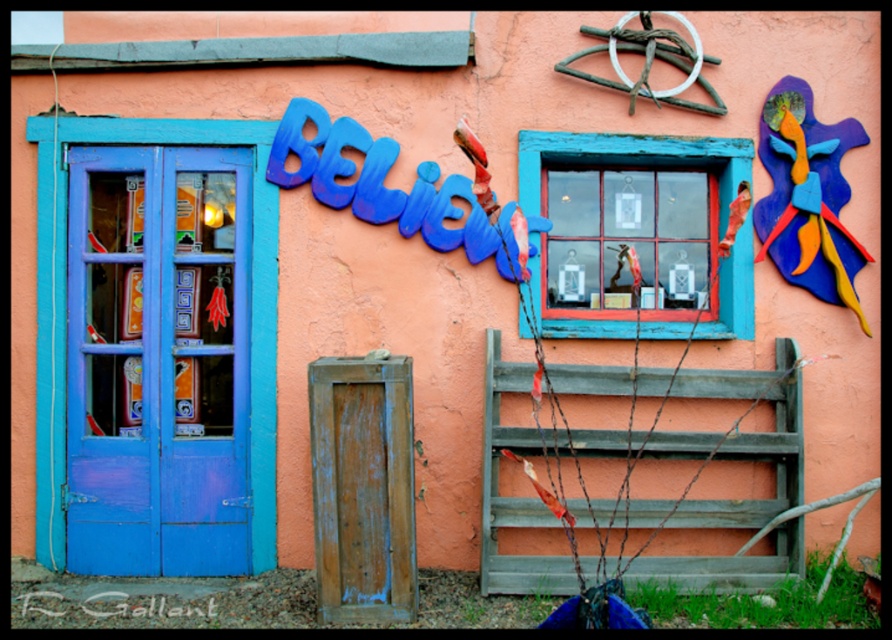
Does point (134, 490) lie behind point (753, 150)?

No, it is in front of (753, 150).

Locate an element on the screen. blue painted wood door at left is located at coordinates (157, 362).

Find the location of `blue painted wood door at left`. blue painted wood door at left is located at coordinates (157, 362).